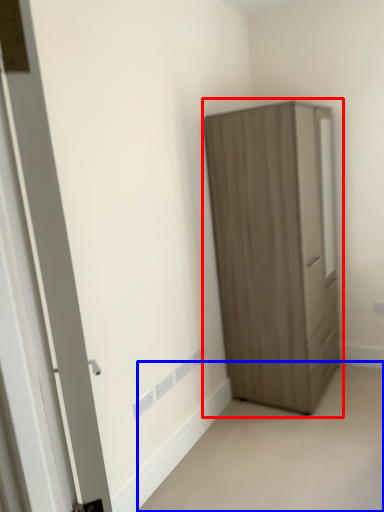
Question: Among these objects, which one is nearest to the camera, cupboard (highlighted by a red box) or corridor (highlighted by a blue box)?

Choices:
 (A) cupboard
 (B) corridor

Answer: (B)